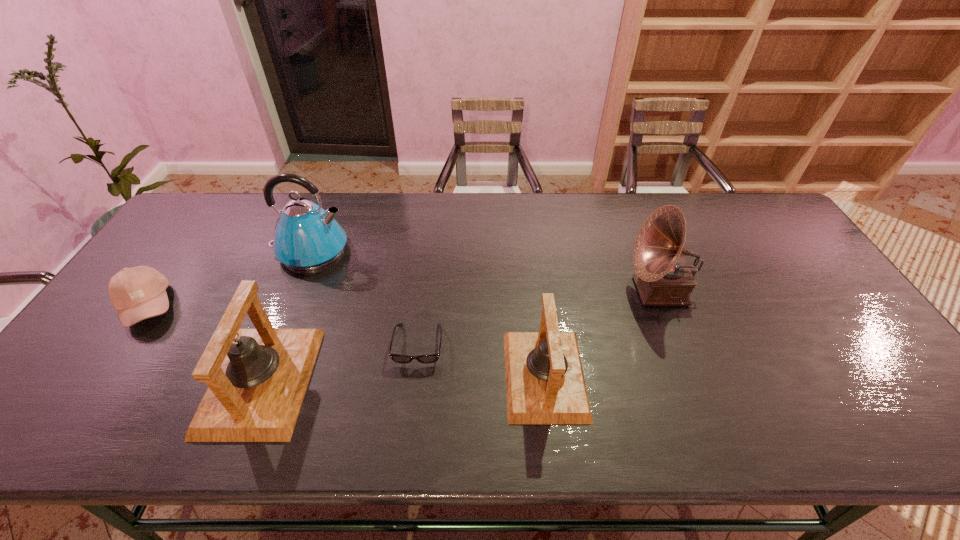
Given the evenly spaced bells in the image, where should an extra bell be added on the right to preserve the spacing? Please point to a vacant space. Please provide its 2D coordinates. Your answer should be formatted as a tuple, i.e. [(x, y)], where the tuple contains the x and y coordinates of a point satisfying the conditions above.

[(823, 370)]